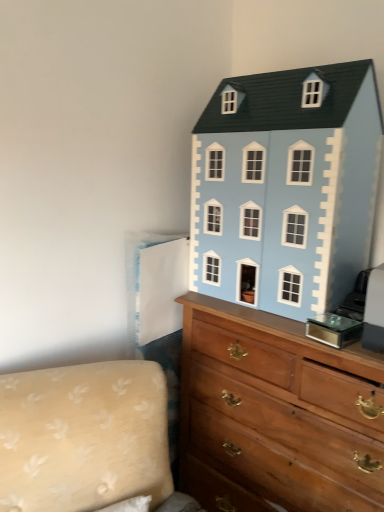
This screenshot has height=512, width=384. What do you see at coordinates (85, 438) in the screenshot?
I see `beige fabric couch at lower left` at bounding box center [85, 438].

Describe the element at coordinates (276, 414) in the screenshot. Image resolution: width=384 pixels, height=512 pixels. I see `wooden chest of drawers at upper right` at that location.

Locate an element on the screen. The height and width of the screenshot is (512, 384). wooden chest of drawers at upper right is located at coordinates (276, 414).

Where is `light blue painted wood dollhouse at upper right`? The height and width of the screenshot is (512, 384). light blue painted wood dollhouse at upper right is located at coordinates (286, 187).

What is the approximate width of light blue painted wood dollhouse at upper right?

light blue painted wood dollhouse at upper right is 14.77 inches wide.

The image size is (384, 512). I want to click on beige fabric couch at lower left, so click(x=85, y=438).

Based on the photo, from a real-world perspective, which object stands above the other?

From a 3D spatial view, light blue painted wood dollhouse at upper right is above.

Do you think light blue painted wood dollhouse at upper right is within wooden chest of drawers at upper right, or outside of it?

light blue painted wood dollhouse at upper right cannot be found inside wooden chest of drawers at upper right.

Can you confirm if light blue painted wood dollhouse at upper right is smaller than wooden chest of drawers at upper right?

Yes.

From the picture: Considering the sizes of objects light blue painted wood dollhouse at upper right and wooden chest of drawers at upper right in the image provided, who is wider, light blue painted wood dollhouse at upper right or wooden chest of drawers at upper right?

Wider between the two is wooden chest of drawers at upper right.

From the image's perspective, is beige fabric couch at lower left located above or below light blue painted wood dollhouse at upper right?

Based on their image positions, beige fabric couch at lower left is located beneath light blue painted wood dollhouse at upper right.

Does beige fabric couch at lower left have a greater width compared to light blue painted wood dollhouse at upper right?

Yes, beige fabric couch at lower left is wider than light blue painted wood dollhouse at upper right.

In the scene shown: Could light blue painted wood dollhouse at upper right be considered to be inside beige fabric couch at lower left?

No, light blue painted wood dollhouse at upper right is not surrounded by beige fabric couch at lower left.

From a real-world perspective, is beige fabric couch at lower left positioned under light blue painted wood dollhouse at upper right based on gravity?

Yes.

Is light blue painted wood dollhouse at upper right positioned with its back to beige fabric couch at lower left?

That's not correct — light blue painted wood dollhouse at upper right is not looking away from beige fabric couch at lower left.

Considering the sizes of objects light blue painted wood dollhouse at upper right and beige fabric couch at lower left in the image provided, who is wider, light blue painted wood dollhouse at upper right or beige fabric couch at lower left?

With larger width is beige fabric couch at lower left.

At what (x,y) coordinates should I click in order to perform the action: click on couch on the left of the light blue painted wood dollhouse at upper right. Please return your answer as a coordinate pair (x, y). Image resolution: width=384 pixels, height=512 pixels. Looking at the image, I should click on (85, 438).

Between wooden chest of drawers at upper right and light blue painted wood dollhouse at upper right, which one appears on the left side from the viewer's perspective?

light blue painted wood dollhouse at upper right.

From the image's perspective, between wooden chest of drawers at upper right and light blue painted wood dollhouse at upper right, who is located below?

wooden chest of drawers at upper right, from the image's perspective.

From a real-world perspective, is wooden chest of drawers at upper right physically located above or below light blue painted wood dollhouse at upper right?

Clearly, from a real-world perspective, wooden chest of drawers at upper right is below light blue painted wood dollhouse at upper right.

Would you say beige fabric couch at lower left is a long distance from wooden chest of drawers at upper right?

Actually, beige fabric couch at lower left and wooden chest of drawers at upper right are a little close together.

Considering the relative sizes of beige fabric couch at lower left and wooden chest of drawers at upper right in the image provided, is beige fabric couch at lower left wider than wooden chest of drawers at upper right?

Indeed, beige fabric couch at lower left has a greater width compared to wooden chest of drawers at upper right.

Looking at the image, does beige fabric couch at lower left seem bigger or smaller compared to wooden chest of drawers at upper right?

beige fabric couch at lower left is smaller than wooden chest of drawers at upper right.

Identify the location of the chest of drawers that is under the beige fabric couch at lower left (from a real-world perspective). (276, 414).

Consider the image. Relative to beige fabric couch at lower left, is wooden chest of drawers at upper right in front or behind?

Visually, wooden chest of drawers at upper right is located behind beige fabric couch at lower left.

Is wooden chest of drawers at upper right not near beige fabric couch at lower left?

They are positioned close to each other.

There is a wooden chest of drawers at upper right. Identify the location of couch above it (from a real-world perspective). (85, 438).

Is wooden chest of drawers at upper right to the left of beige fabric couch at lower left from the viewer's perspective?

In fact, wooden chest of drawers at upper right is to the right of beige fabric couch at lower left.

I want to click on chest of drawers on the right of light blue painted wood dollhouse at upper right, so click(276, 414).

Find the location of a particular element. The height and width of the screenshot is (512, 384). toy behind the beige fabric couch at lower left is located at coordinates (286, 187).

Estimate the real-world distances between objects in this image. Which object is closer to beige fabric couch at lower left, wooden chest of drawers at upper right or light blue painted wood dollhouse at upper right?

wooden chest of drawers at upper right is positioned closer to the anchor beige fabric couch at lower left.

Which object lies further to the anchor point wooden chest of drawers at upper right, beige fabric couch at lower left or light blue painted wood dollhouse at upper right?

beige fabric couch at lower left.

Looking at the image, which one is located further to light blue painted wood dollhouse at upper right, beige fabric couch at lower left or wooden chest of drawers at upper right?

The object further to light blue painted wood dollhouse at upper right is beige fabric couch at lower left.

Looking at the image, which one is located closer to light blue painted wood dollhouse at upper right, wooden chest of drawers at upper right or beige fabric couch at lower left?

The object closer to light blue painted wood dollhouse at upper right is wooden chest of drawers at upper right.

Considering their positions, is light blue painted wood dollhouse at upper right positioned closer to wooden chest of drawers at upper right than beige fabric couch at lower left?

light blue painted wood dollhouse at upper right lies closer to wooden chest of drawers at upper right than the other object.

Based on their spatial positions, is light blue painted wood dollhouse at upper right or wooden chest of drawers at upper right closer to beige fabric couch at lower left?

wooden chest of drawers at upper right is closer to beige fabric couch at lower left.

This screenshot has width=384, height=512. Identify the location of chest of drawers between light blue painted wood dollhouse at upper right and beige fabric couch at lower left in the vertical direction. (276, 414).